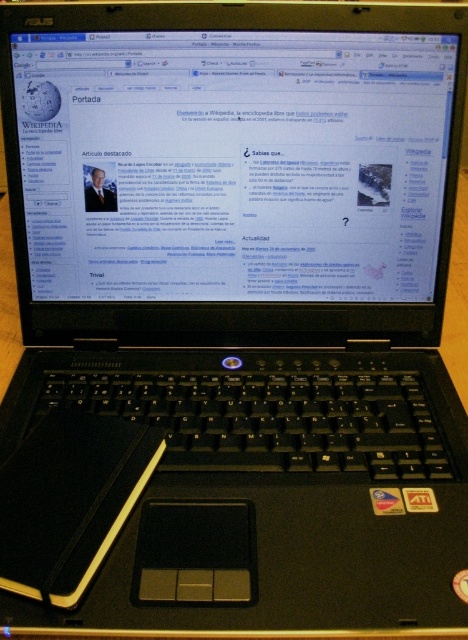
Which of these two, matte black screen at center or black leather notebook at lower left, stands taller?

matte black screen at center

Can you confirm if matte black screen at center is taller than black leather notebook at lower left?

Correct, matte black screen at center is much taller as black leather notebook at lower left.

You are a GUI agent. You are given a task and a screenshot of the screen. Output one action in this format:
    pyautogui.click(x=<x>, y=<y>)
    Task: Click on the matte black screen at center
    The image size is (468, 640).
    Given the screenshot: What is the action you would take?
    pyautogui.click(x=234, y=163)